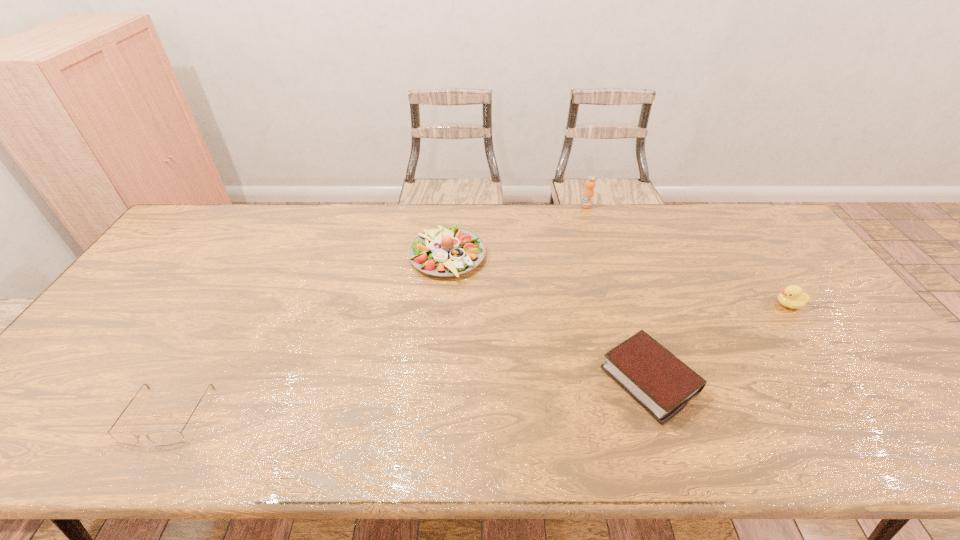
Find the location of a particular element. The width and height of the screenshot is (960, 540). vacant space situated on the beak of the third nearest object is located at coordinates (694, 305).

Image resolution: width=960 pixels, height=540 pixels. What are the coordinates of `vacant space situated 0.100m on the beak of the third nearest object` in the screenshot? It's located at (739, 305).

This screenshot has height=540, width=960. Find the location of `vacant space located 0.340m on the beak of the third nearest object`. vacant space located 0.340m on the beak of the third nearest object is located at coordinates (656, 305).

The width and height of the screenshot is (960, 540). I want to click on free point located 0.270m on the right of the Bible, so click(x=807, y=380).

Identify the location of orange juice that is at the far edge. (588, 194).

Find the location of a particular element. The height and width of the screenshot is (540, 960). salad plate positioned at the far edge is located at coordinates (445, 251).

Locate an element on the screen. Image resolution: width=960 pixels, height=540 pixels. Bible present at the near edge is located at coordinates (660, 382).

The image size is (960, 540). I want to click on spectacles present at the near edge, so click(167, 437).

Locate an element on the screen. The width and height of the screenshot is (960, 540). object present at the right edge is located at coordinates (792, 296).

The image size is (960, 540). What are the coordinates of `vacant area at the far edge of the desktop` in the screenshot? It's located at coord(681,237).